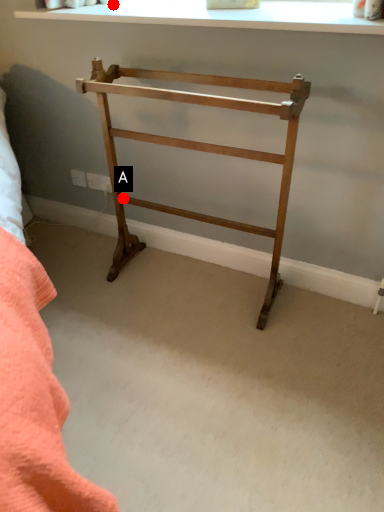
Question: Two points are circled on the image, labeled by A and B beside each circle. Which point is farther to the camera?

Choices:
 (A) A is further
 (B) B is further

Answer: (A)